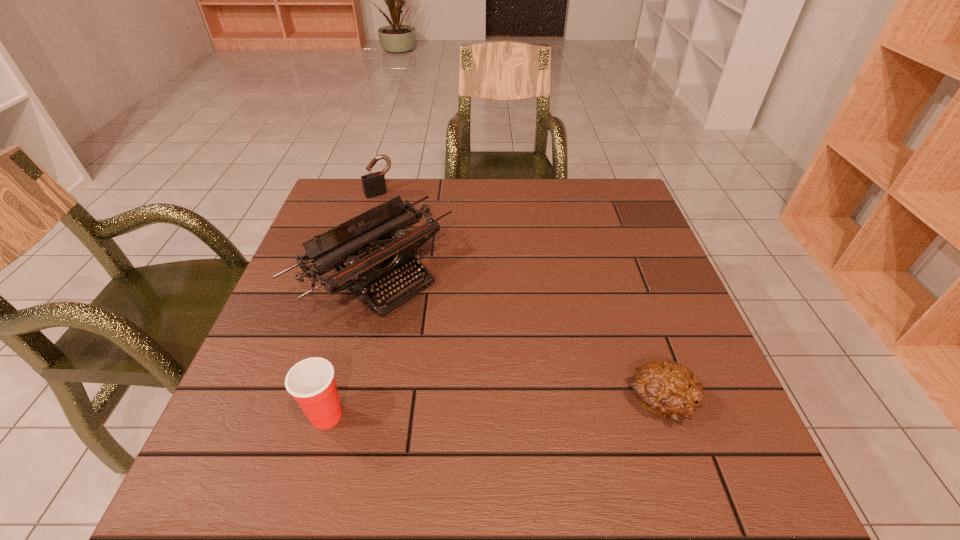
I want to click on Dixie cup, so click(311, 382).

I want to click on muffin, so click(665, 388).

I want to click on the rightmost object, so click(x=665, y=388).

At what (x,y) coordinates should I click in order to perform the action: click on the tallest object. Please return your answer as a coordinate pair (x, y). The width and height of the screenshot is (960, 540). Looking at the image, I should click on (377, 267).

Locate an element on the screen. typewriter is located at coordinates (377, 267).

Find the location of a particular element. The height and width of the screenshot is (540, 960). the farthest object is located at coordinates (374, 184).

Image resolution: width=960 pixels, height=540 pixels. I want to click on vacant space located on the right of the Dixie cup, so click(x=393, y=415).

You are a GUI agent. You are given a task and a screenshot of the screen. Output one action in this format:
    pyautogui.click(x=<x>, y=<y>)
    Task: Click on the free space located on the back of the muffin
    Image resolution: width=960 pixels, height=540 pixels.
    Given the screenshot: What is the action you would take?
    pyautogui.click(x=613, y=264)

At what (x,y) coordinates should I click in order to perform the action: click on vacant space located 0.180m on the typing side of the tallest object. Please return your answer as a coordinate pair (x, y). The image size is (960, 540). Looking at the image, I should click on (483, 362).

Identify the location of vacant space located 0.270m on the typing side of the tallest object. Image resolution: width=960 pixels, height=540 pixels. (517, 390).